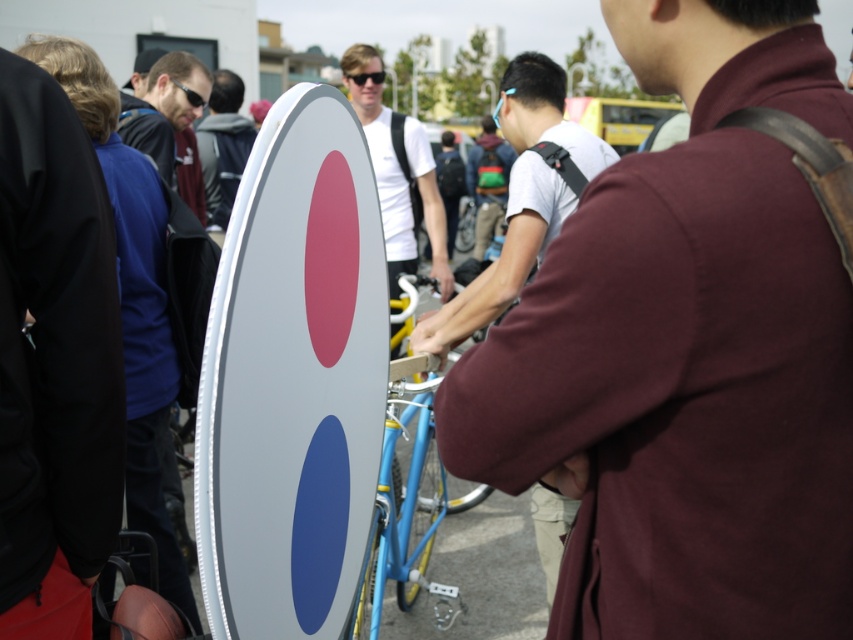
How distant is blue metallic bicycle at center from white matte t-shirt at center?

blue metallic bicycle at center is 1.31 meters from white matte t-shirt at center.

Which is above, blue metallic bicycle at center or white matte t-shirt at center?

Positioned higher is white matte t-shirt at center.

Image resolution: width=853 pixels, height=640 pixels. What do you see at coordinates (408, 506) in the screenshot? I see `blue metallic bicycle at center` at bounding box center [408, 506].

I want to click on blue metallic bicycle at center, so click(x=408, y=506).

Between blue metallic bicycle at center and matte black jacket at upper left, which one has less height?

Standing shorter between the two is blue metallic bicycle at center.

Consider the image. Does blue metallic bicycle at center lie in front of matte black jacket at upper left?

Yes, blue metallic bicycle at center is closer to the viewer.

Between point (395, 458) and point (221, 209), which one is positioned in front?

Point (395, 458)

This screenshot has width=853, height=640. I want to click on blue metallic bicycle at center, so click(x=408, y=506).

Which is in front, point (732, 108) or point (480, 256)?

Point (732, 108) is in front.

Find the location of a particular element. The image size is (853, 640). maroon fabric shirt at upper right is located at coordinates (688, 353).